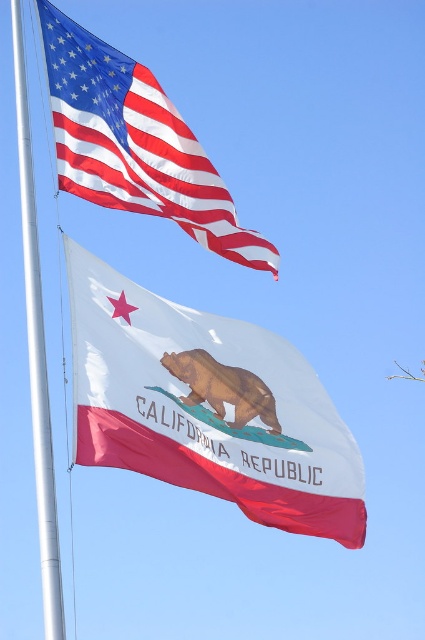
Question: Which point appears farthest from the camera in this image?

Choices:
 (A) (36, 392)
 (B) (235, 401)
 (C) (150, 193)

Answer: (C)

Question: Can you confirm if matte fabric flag at upper left is positioned above silver metallic flag pole at left?

Choices:
 (A) no
 (B) yes

Answer: (A)

Question: Can you confirm if matte fabric flag at upper left is positioned below silver metallic flag pole at left?

Choices:
 (A) no
 (B) yes

Answer: (B)

Question: Which object is closer to the camera taking this photo?

Choices:
 (A) matte fabric flag at upper left
 (B) brown matte bear at center
 (C) silver metallic flag pole at left
 (D) white glossy fabric flag at center

Answer: (C)

Question: Which is nearer to the silver metallic flag pole at left?

Choices:
 (A) white glossy fabric flag at center
 (B) brown matte bear at center

Answer: (A)

Question: Does white glossy fabric flag at center appear on the left side of brown matte bear at center?

Choices:
 (A) yes
 (B) no

Answer: (B)